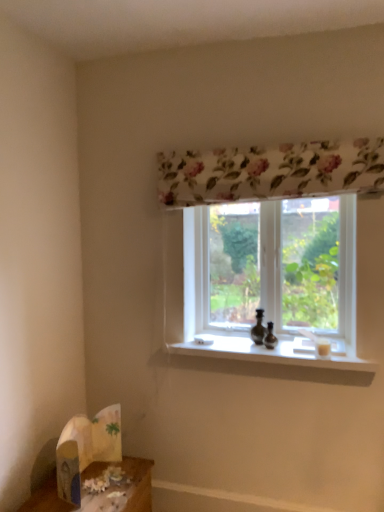
Question: From the image's perspective, is white paper bag at lower left over transparent glass window at center?

Choices:
 (A) no
 (B) yes

Answer: (A)

Question: Can you confirm if white paper bag at lower left is wider than transparent glass window at center?

Choices:
 (A) yes
 (B) no

Answer: (A)

Question: Is white paper bag at lower left next to transparent glass window at center and touching it?

Choices:
 (A) no
 (B) yes

Answer: (A)

Question: Can you confirm if white paper bag at lower left is taller than transparent glass window at center?

Choices:
 (A) yes
 (B) no

Answer: (B)

Question: Would you say transparent glass window at center is part of white paper bag at lower left's contents?

Choices:
 (A) no
 (B) yes

Answer: (A)

Question: Considering the relative sizes of white paper bag at lower left and transparent glass window at center in the image provided, is white paper bag at lower left smaller than transparent glass window at center?

Choices:
 (A) yes
 (B) no

Answer: (A)

Question: Is white paper bag at lower left further to the viewer compared to wooden table at lower left?

Choices:
 (A) yes
 (B) no

Answer: (A)

Question: Is wooden table at lower left inside white paper bag at lower left?

Choices:
 (A) yes
 (B) no

Answer: (B)

Question: Is white paper bag at lower left completely or partially outside of wooden table at lower left?

Choices:
 (A) no
 (B) yes

Answer: (B)

Question: Is white paper bag at lower left to the left of wooden table at lower left from the viewer's perspective?

Choices:
 (A) no
 (B) yes

Answer: (B)

Question: Can you confirm if white paper bag at lower left is wider than wooden table at lower left?

Choices:
 (A) yes
 (B) no

Answer: (B)

Question: From the image's perspective, would you say white paper bag at lower left is shown under wooden table at lower left?

Choices:
 (A) no
 (B) yes

Answer: (A)

Question: Would you say transparent glass window at center is outside wooden table at lower left?

Choices:
 (A) yes
 (B) no

Answer: (A)